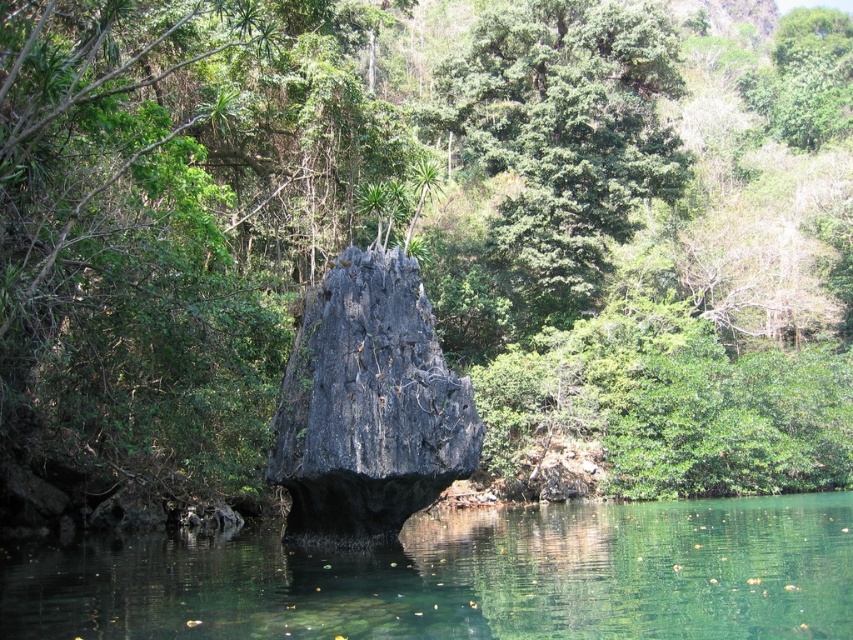
Consider the image. You are standing at the edge of a natural pool and want to jump into the green translucent water at center. The safety guidelines state that you must be at least 30 feet away from the water to ensure a safe jump. Are you within the recommended distance?

The distance between you and the green translucent water at center is 33.27 feet, which exceeds the minimum requirement of 30 feet. Therefore, you are within the recommended safe distance for jumping.